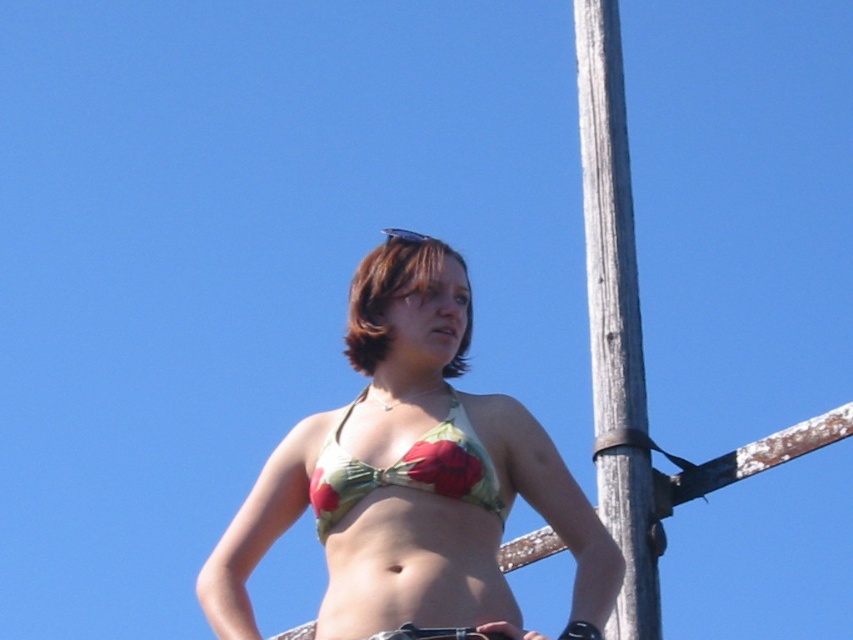
Can you confirm if green floral bikini top at center is wider than floral fabric bikini top at center?

Yes, green floral bikini top at center is wider than floral fabric bikini top at center.

Is point (403, 536) farther from camera compared to point (445, 445)?

That is False.

This screenshot has height=640, width=853. In order to click on green floral bikini top at center in this screenshot , I will do `click(412, 477)`.

Describe the element at coordinates (614, 321) in the screenshot. This screenshot has width=853, height=640. I see `wooden pole at right` at that location.

Is wooden pole at right above brown matte hair at center?

Yes.

Identify the location of wooden pole at right. coord(614,321).

Can you confirm if floral fabric bikini top at center is positioned to the right of transparent plastic goggles at upper center?

Correct, you'll find floral fabric bikini top at center to the right of transparent plastic goggles at upper center.

Can you confirm if floral fabric bikini top at center is shorter than transparent plastic goggles at upper center?

Correct, floral fabric bikini top at center is not as tall as transparent plastic goggles at upper center.

The width and height of the screenshot is (853, 640). What do you see at coordinates (405, 468) in the screenshot?
I see `floral fabric bikini top at center` at bounding box center [405, 468].

Identify the location of floral fabric bikini top at center. (405, 468).